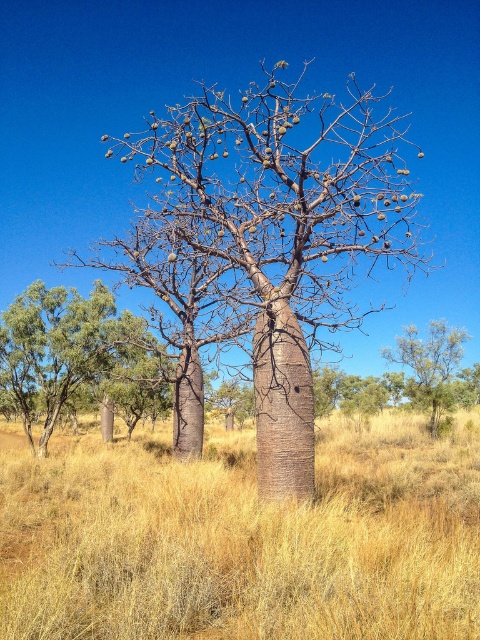
You are an artist planning to paint the baobab trees. You want to highlight the contrast between the smooth brown tree trunk at center and the green rough bark tree at lower left. Which tree trunk should you emphasize as wider in your painting?

The smooth brown tree trunk at center is wider than the green rough bark tree at lower left, so you should emphasize the smooth brown tree trunk at center as wider in your painting.

You are standing at the point with coordinates point (46, 342) and want to walk towards the point with coordinates point (394, 360). According to the scene description, will you be moving towards or away from the baobab trees in the midground?

Since point (46, 342) is in front of point (394, 360), moving from point (46, 342) towards point (394, 360) means you are moving away from the baobab trees in the midground.

You are standing at the point indicated by the coordinates point (x=61, y=348) in the image. What type of tree is directly in front of you?

The point (x=61, y=348) indicates a green rough bark tree at lower left, so the tree directly in front of you is a green rough bark tree at lower left.